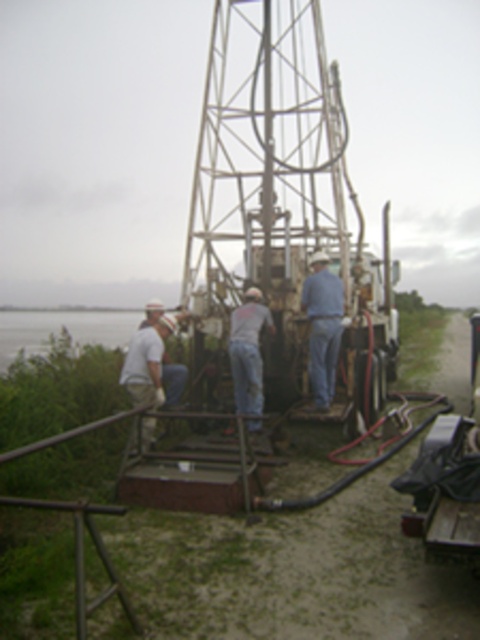
You are a photographer planning to take a photo of the blue jeans at center and gray denim jeans at center. Since you want both pairs of jeans to be clearly visible in the frame, which pair should you focus on to ensure they are in focus without adjusting the camera settings?

The blue jeans at center has a lesser width compared to gray denim jeans at center, so you should focus on the gray denim jeans at center to ensure both are in focus since it is wider and requires more attention.

Consider the image. You are a worker at the drilling site and you see both the blue jeans at center and the gray denim jeans at center. Which pair of jeans is positioned to the right side?

The blue jeans at center is positioned to the right of the gray denim jeans at center, so the blue jeans at center is the one on the right side.

You are an observer standing in front of the mobile drilling rig. You notice two pieces of clothing in the scene. Which one is narrower between the blue jeans at center and the white matte shirt at left?

The blue jeans at center is thinner than the white matte shirt at left, so the blue jeans at center is narrower.